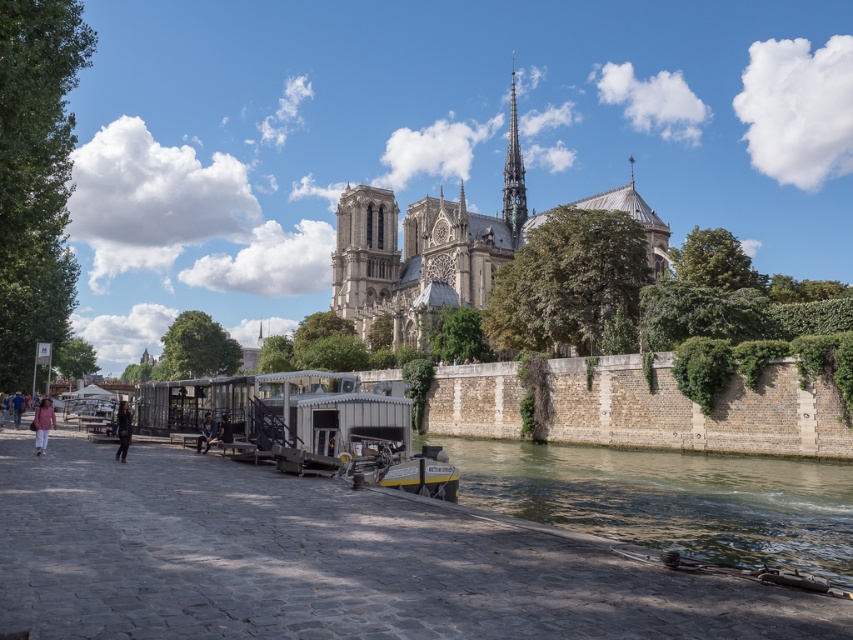
You are standing at the point closer to the camera between point (x=403, y=227) and point (x=202, y=442). Which point are you at?

You are at point (x=403, y=227) because it is further to the camera than point (x=202, y=442).

You are a tourist standing on the cobblestone walkway in front of the stone gothic cathedral at center. You want to take a photo of the cathedral with the blue denim jeans at center in the foreground. Will the cathedral appear wider than the jeans in the photo?

The stone gothic cathedral at center is wider than the blue denim jeans at center, so in the photo, the cathedral will indeed appear wider than the jeans.

You are a tourist standing on the cobblestone walkway near the Seine River in Paris. You want to take a photo of the stone gothic cathedral at center while ensuring the blue denim jeans at center are also visible in the frame. Which object should be placed closer to the camera to include both in the photo?

The blue denim jeans at center should be placed closer to the camera because the stone gothic cathedral at center is positioned on the right side of the blue denim jeans at center, so moving the jeans forward would allow both to be captured in the photo.